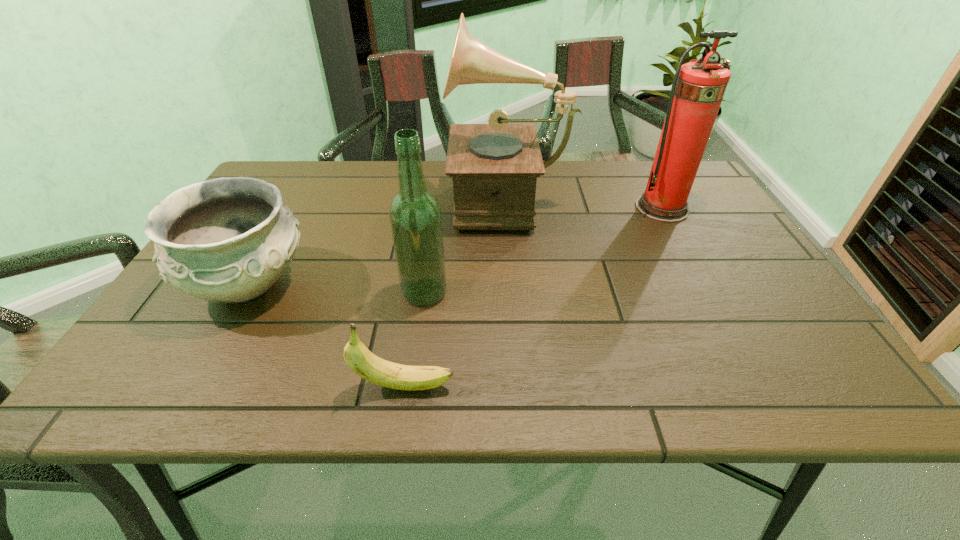
Where is `free space located at the discharge end of the fire extinguisher`? Image resolution: width=960 pixels, height=540 pixels. free space located at the discharge end of the fire extinguisher is located at coordinates (683, 247).

Where is `vacant space situated 0.370m on the back of the liquor`? This screenshot has width=960, height=540. vacant space situated 0.370m on the back of the liquor is located at coordinates (438, 192).

Identify the location of free point located on the right of the leftmost object. (482, 285).

Locate an element on the screen. vacant position located 0.330m at the start of the peel on the nearest object is located at coordinates (640, 386).

The height and width of the screenshot is (540, 960). I want to click on record player that is at the far edge, so click(x=494, y=167).

This screenshot has width=960, height=540. I want to click on fire extinguisher positioned at the far edge, so click(x=698, y=88).

This screenshot has width=960, height=540. What are the coordinates of `object that is positioned at the near edge` in the screenshot? It's located at (364, 363).

Identify the location of object that is at the left edge. (229, 240).

This screenshot has height=540, width=960. Find the location of `object that is at the right edge`. object that is at the right edge is located at coordinates (698, 88).

At what (x,y) coordinates should I click in order to perform the action: click on object situated at the far right corner. Please return your answer as a coordinate pair (x, y). The width and height of the screenshot is (960, 540). Looking at the image, I should click on (698, 88).